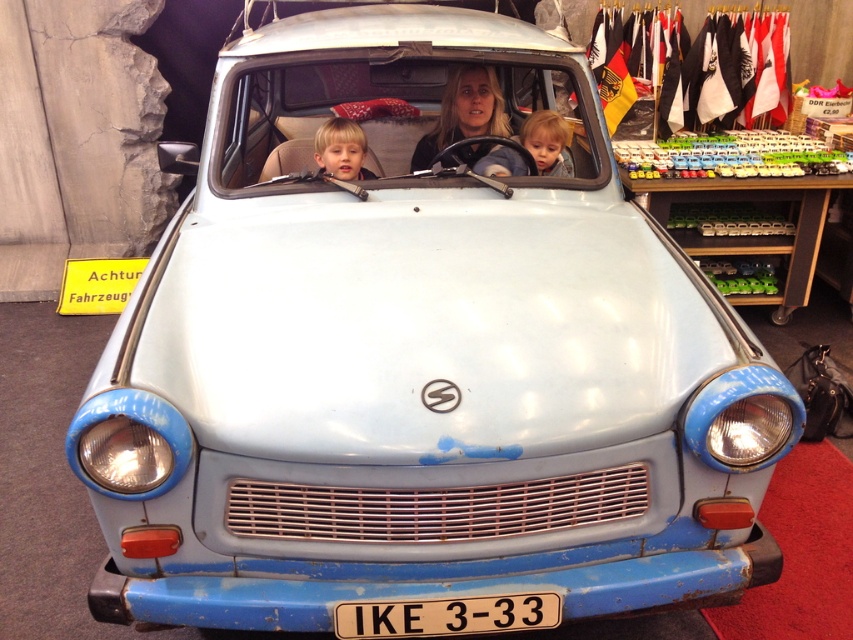
Who is higher up, white plastic license plate at center or matte black hair at center?

matte black hair at center is above.

Does white plastic license plate at center appear over matte black hair at center?

No.

Who is more forward, (339, 621) or (457, 77)?

Point (339, 621) is in front.

Identify the location of white plastic license plate at center. Image resolution: width=853 pixels, height=640 pixels. (447, 616).

Is white plastic license plate at center positioned at the back of smooth skin child at center?

No, white plastic license plate at center is in front of smooth skin child at center.

Is white plastic license plate at center to the right of smooth skin child at center from the viewer's perspective?

In fact, white plastic license plate at center is to the left of smooth skin child at center.

Is point (335, 624) positioned after point (554, 115)?

No, it is not.

The height and width of the screenshot is (640, 853). I want to click on white plastic license plate at center, so point(447,616).

The width and height of the screenshot is (853, 640). Describe the element at coordinates (447, 616) in the screenshot. I see `white plastic license plate at center` at that location.

Locate an element on the screen. white plastic license plate at center is located at coordinates (447, 616).

You are a GUI agent. You are given a task and a screenshot of the screen. Output one action in this format:
    pyautogui.click(x=<x>, y=<y>)
    Task: Click on the white plastic license plate at center
    Image resolution: width=853 pixels, height=640 pixels.
    Given the screenshot: What is the action you would take?
    447,616